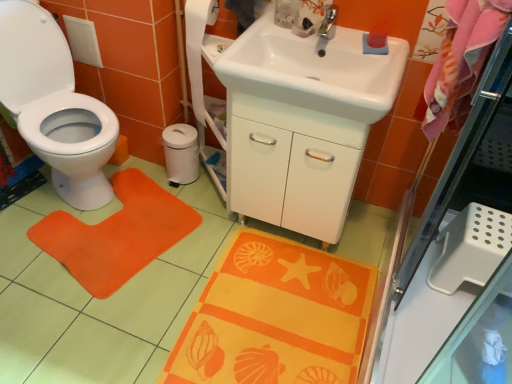
This screenshot has height=384, width=512. Identify the location of vacant region to the left of silver metallic faucet at upper center. (270, 40).